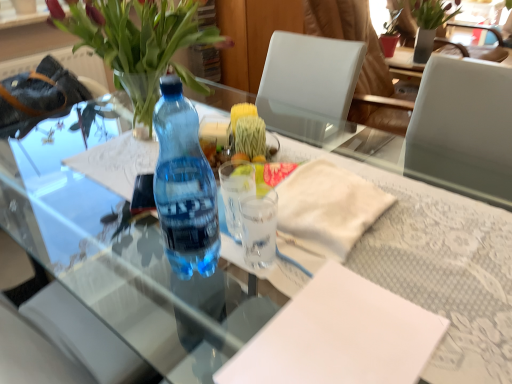
Question: Does white paper at center, the first notepad when ordered from top to bottom, have a lesser width compared to translucent glass vase at upper left?

Choices:
 (A) yes
 (B) no

Answer: (A)

Question: Can you confirm if white paper at center, marked as the 1th notepad in a back-to-front arrangement, is taller than translucent glass vase at upper left?

Choices:
 (A) yes
 (B) no

Answer: (B)

Question: From a real-world perspective, is white paper at center, the first notepad when ordered from top to bottom, beneath translucent glass vase at upper left?

Choices:
 (A) yes
 (B) no

Answer: (A)

Question: From the image's perspective, is white paper at center, marked as the 1th notepad in a back-to-front arrangement, on translucent glass vase at upper left?

Choices:
 (A) no
 (B) yes

Answer: (A)

Question: From a real-world perspective, is white paper at center, the second notepad in the front-to-back sequence, physically above translucent glass vase at upper left?

Choices:
 (A) no
 (B) yes

Answer: (A)

Question: Does point (292, 339) appear closer or farther from the camera than point (415, 39)?

Choices:
 (A) farther
 (B) closer

Answer: (B)

Question: Looking at the image, does white paper at center, which is the 1th notepad from front to back, seem bigger or smaller compared to green matte vase at upper right?

Choices:
 (A) small
 (B) big

Answer: (A)

Question: Is white paper at center, the 2th notepad when ordered from top to bottom, to the left or to the right of green matte vase at upper right in the image?

Choices:
 (A) right
 (B) left

Answer: (B)

Question: In terms of width, does white paper at center, positioned as the second notepad in back-to-front order, look wider or thinner when compared to green matte vase at upper right?

Choices:
 (A) thin
 (B) wide

Answer: (A)

Question: Relative to green matte vase at upper right, is transparent glass cup at center, which is the second coffee cup from back to front, in front or behind?

Choices:
 (A) front
 (B) behind

Answer: (A)

Question: Based on their sizes in the image, would you say transparent glass cup at center, acting as the 1th coffee cup starting from the front, is bigger or smaller than green matte vase at upper right?

Choices:
 (A) big
 (B) small

Answer: (B)

Question: Is transparent glass cup at center, acting as the 1th coffee cup starting from the front, taller or shorter than green matte vase at upper right?

Choices:
 (A) short
 (B) tall

Answer: (A)

Question: Choose the correct answer: Is transparent glass cup at center, acting as the 1th coffee cup starting from the front, inside green matte vase at upper right or outside it?

Choices:
 (A) outside
 (B) inside

Answer: (A)

Question: Would you say white paper at center, which is the 1th notepad from front to back, is to the left or to the right of transparent plastic bottle at center in the picture?

Choices:
 (A) right
 (B) left

Answer: (A)

Question: Considering the positions of point (411, 304) and point (187, 274), is point (411, 304) closer or farther from the camera than point (187, 274)?

Choices:
 (A) closer
 (B) farther

Answer: (A)